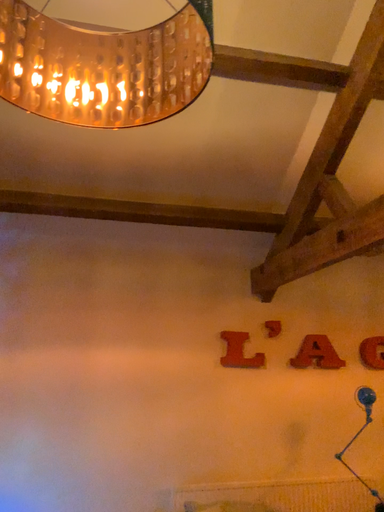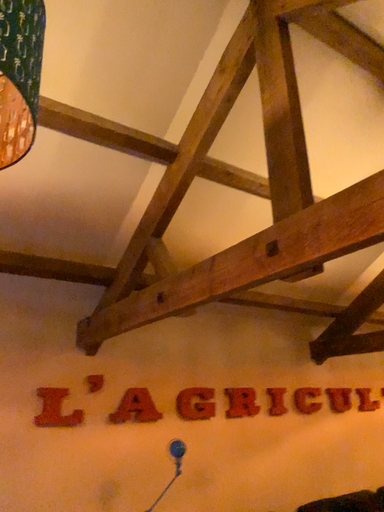
Question: Which way did the camera rotate in the video?

Choices:
 (A) rotated left
 (B) rotated right

Answer: (B)